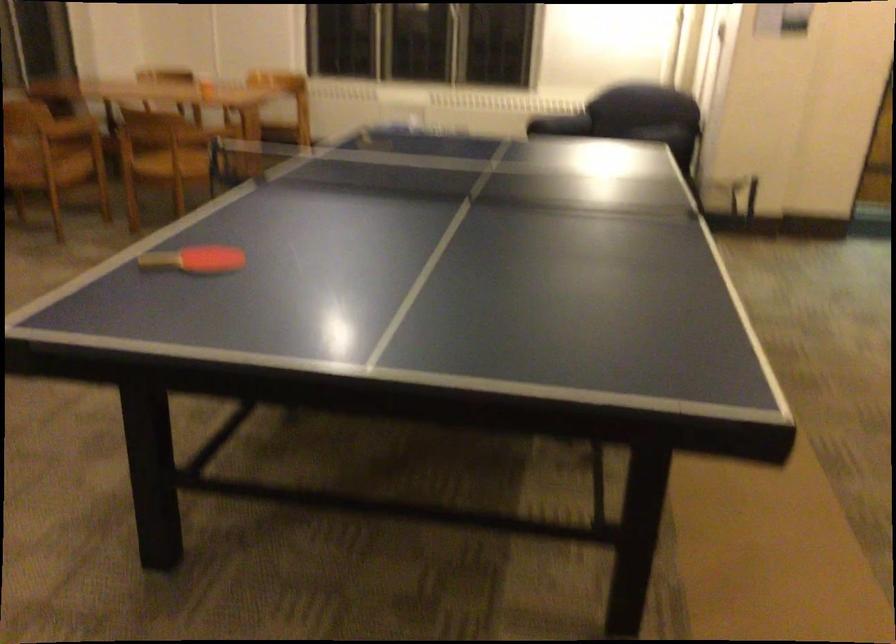
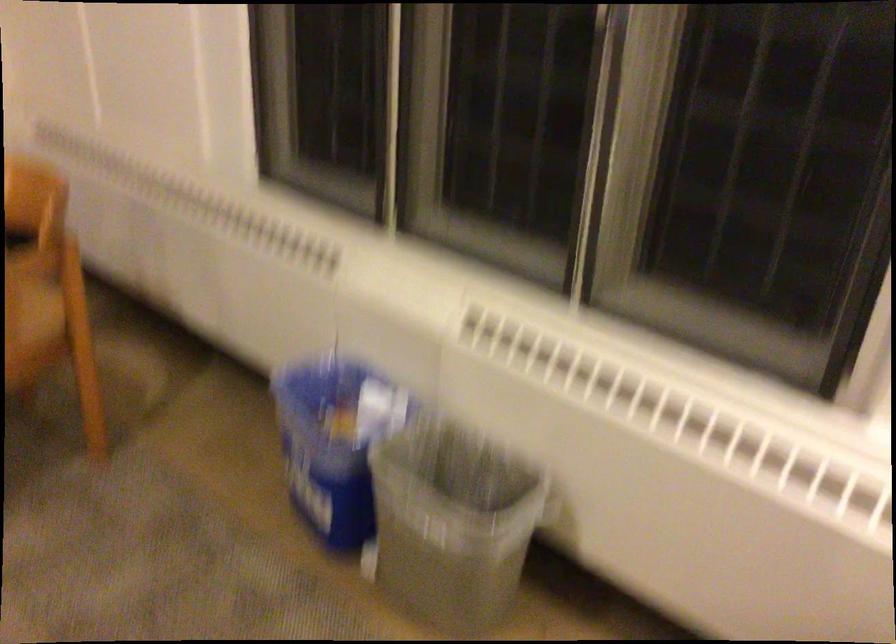
The point at [474,133] is marked in the first image. Where is the corresponding point in the second image?

(451, 524)